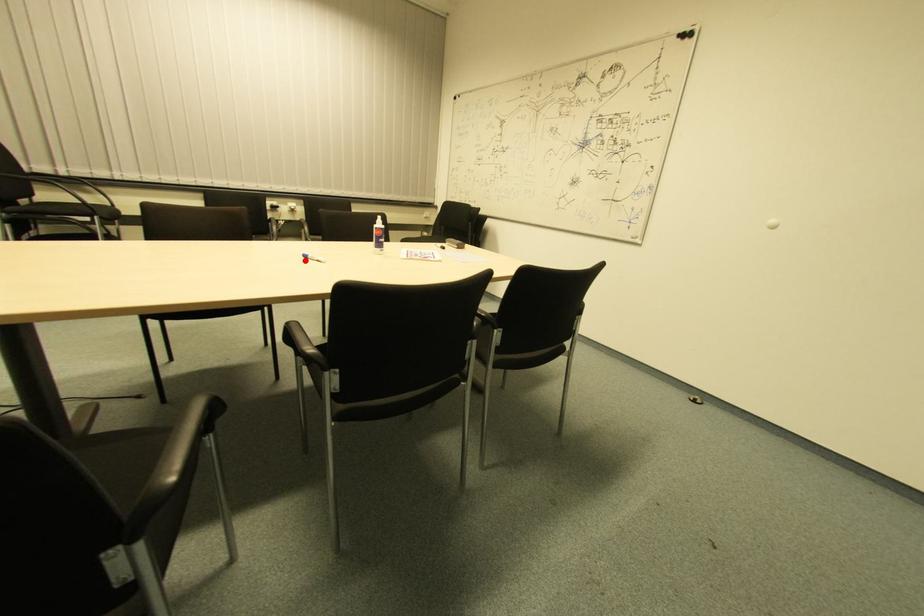
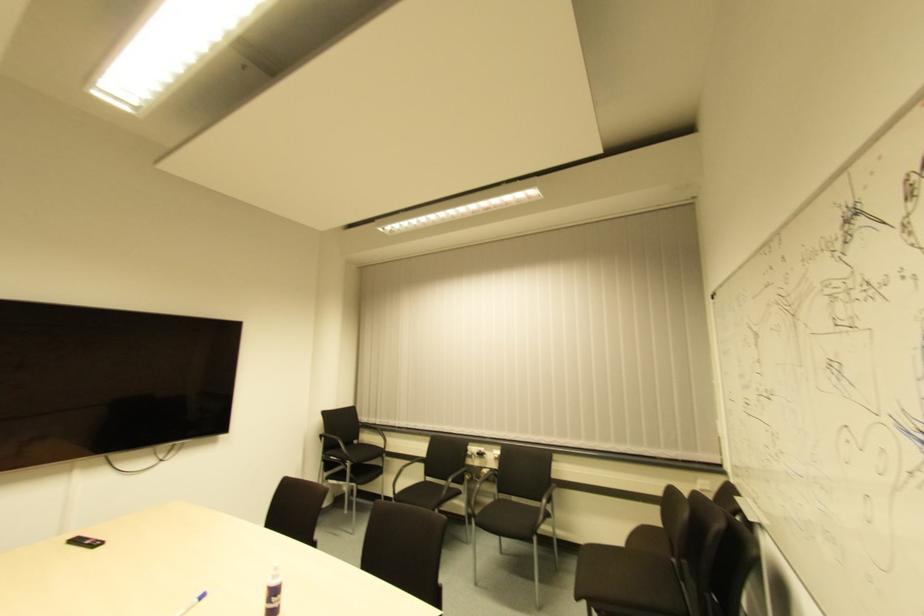
Find the pixel in the second image that matches the highlighted location in the first image.

(202, 600)